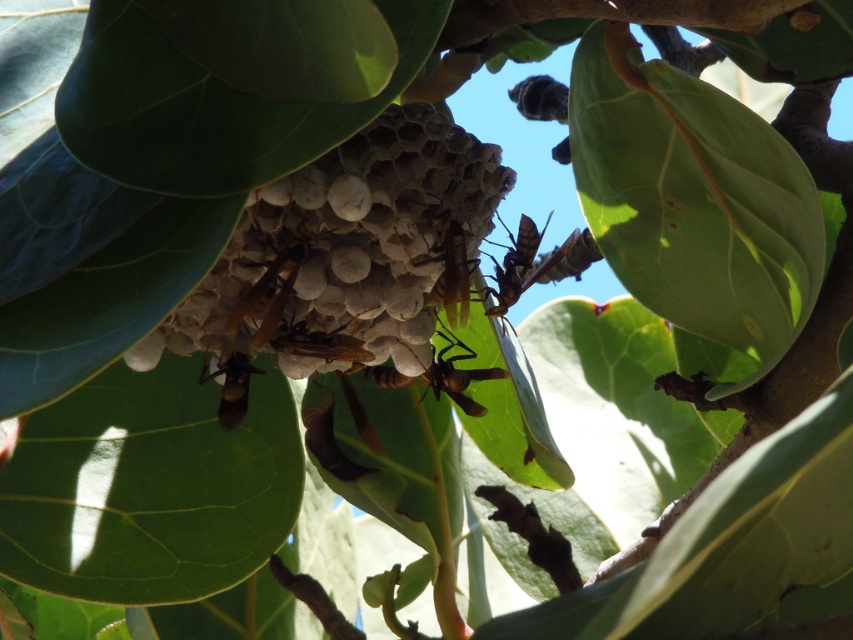
You are a biologist studying the wasp nest. You notice a specific point in the image at coordinates (349, 252). Based on the scene description, what does this point likely represent?

The point at (349, 252) corresponds to the white honeycomb at center, which is the main structure of the wasp nest.

You are a researcher observing two insects, a brown matte wasp at center and a brown matte bee at center, on a wasp nest. Which insect takes up more space in the image?

The brown matte bee at center takes up more space in the image than the brown matte wasp at center because the brown matte wasp at center occupies less space than the brown matte bee at center.